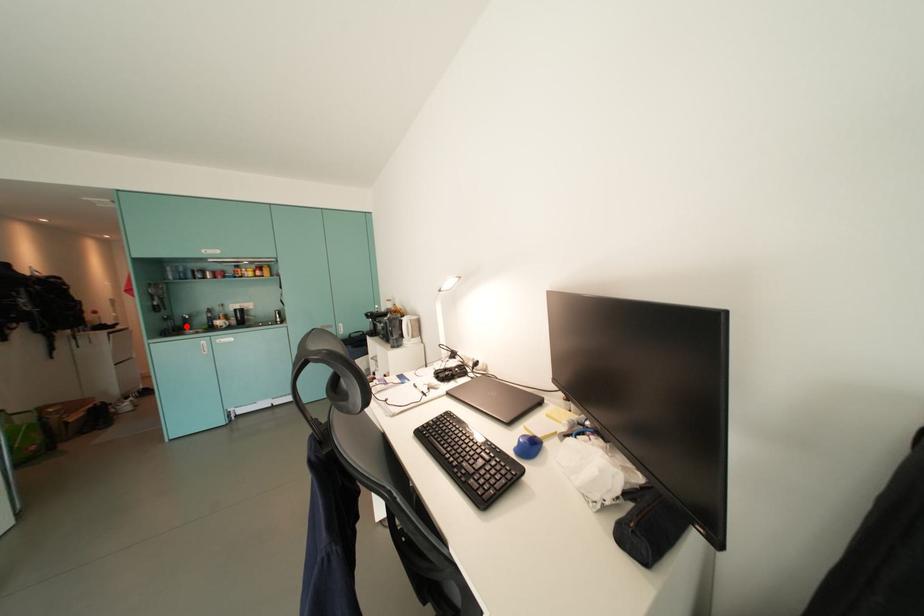
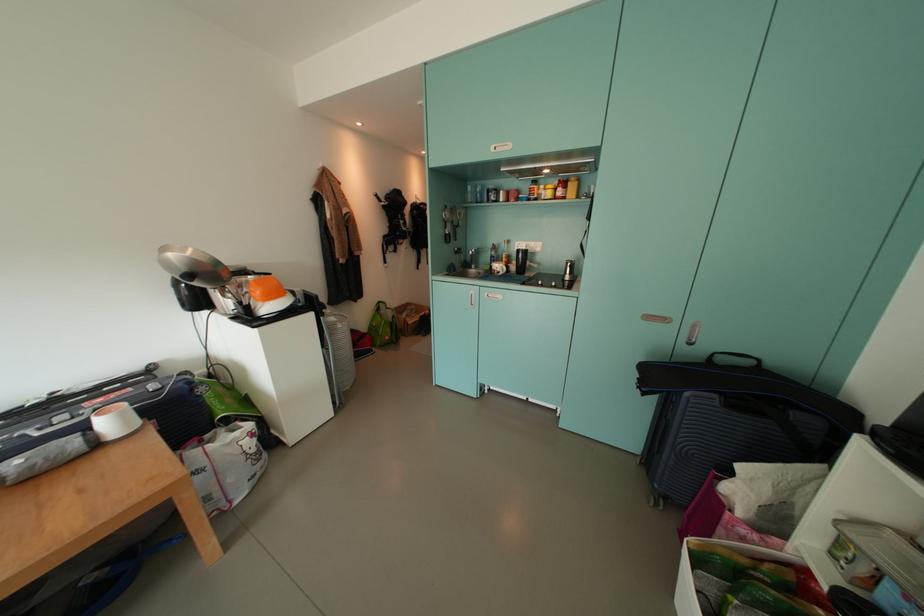
Question: A red point is marked in image1. In image2, is the corresponding 3D point closer to the camera or farther? Reply with the corresponding letter.

Choices:
 (A) The corresponding 3D point is closer.
 (B) The corresponding 3D point is farther.

Answer: (A)